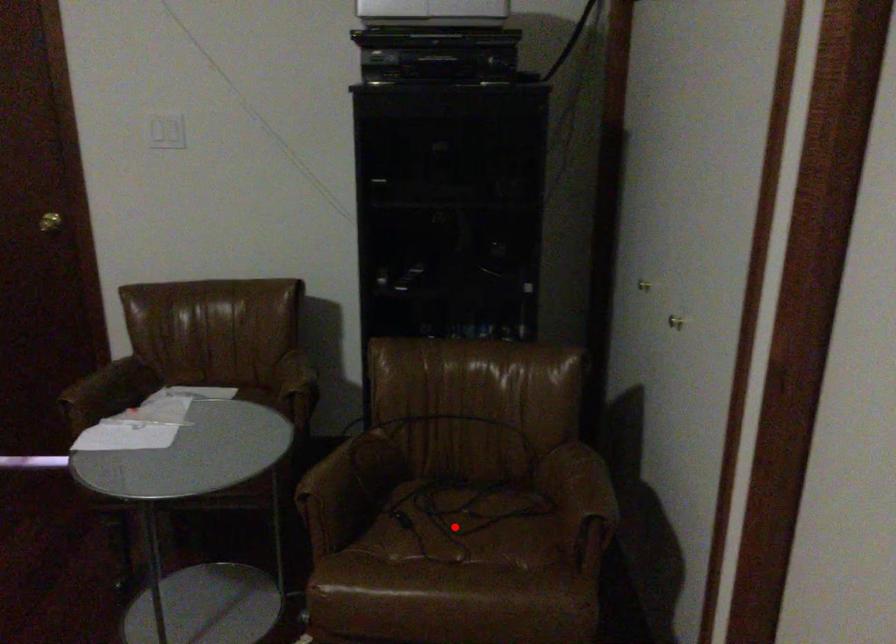
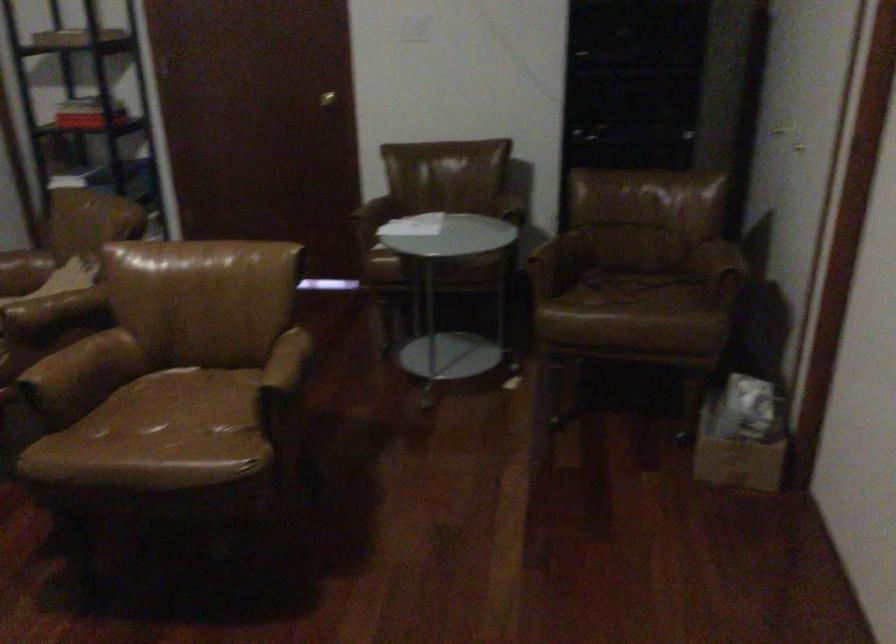
Question: I am providing you with two images of the same scene from different viewpoints. Image1 has a red point marked. In image2, the corresponding 3D location appears at what relative position? Reply with the corresponding letter.

Choices:
 (A) Closer
 (B) Farther

Answer: (B)